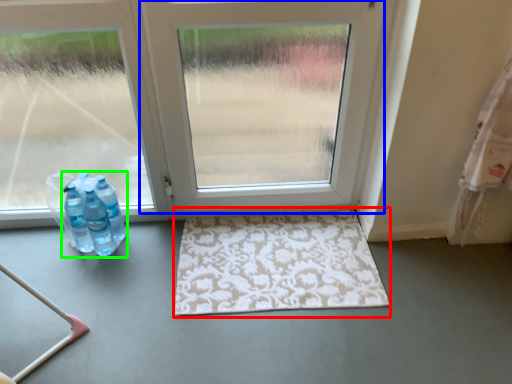
Question: Considering the real-world distances, which object is closest to bath mat (highlighted by a red box)? door (highlighted by a blue box) or bottle (highlighted by a green box).

Choices:
 (A) door
 (B) bottle

Answer: (A)